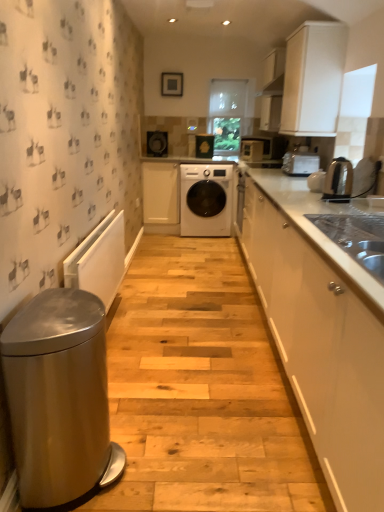
The image size is (384, 512). Identify the location of vacant space to the right of metallic silver kettle at right, which appears as the 1th home appliance when ordered from the bottom. (360, 203).